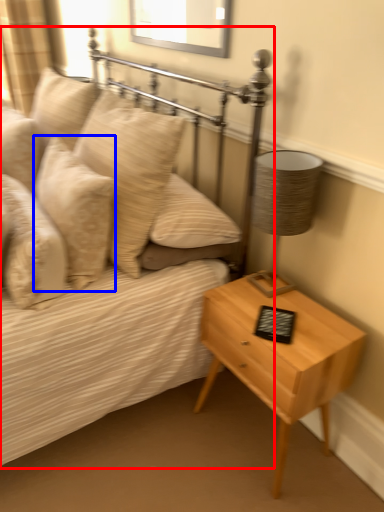
Question: Which of the following is the closest to the observer, bed (highlighted by a red box) or pillow (highlighted by a blue box)?

Choices:
 (A) bed
 (B) pillow

Answer: (A)